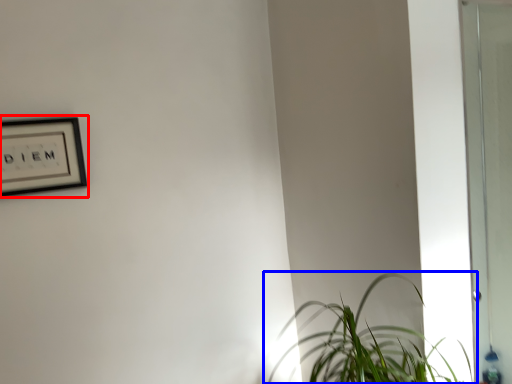
Question: Among these objects, which one is nearest to the camera, picture frame (highlighted by a red box) or houseplant (highlighted by a blue box)?

Choices:
 (A) picture frame
 (B) houseplant

Answer: (B)